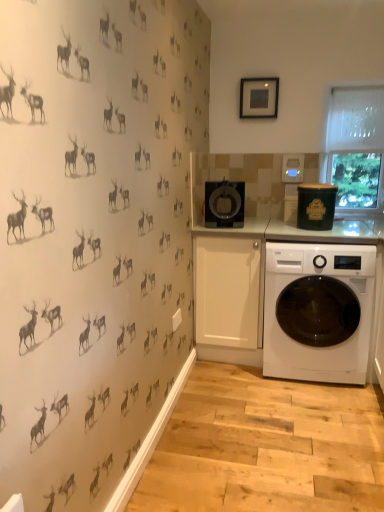
Measure the distance between point (228, 203) and camera.

Point (228, 203) and camera are 8.57 feet apart.

This screenshot has width=384, height=512. Describe the element at coordinates (259, 97) in the screenshot. I see `matte black picture frame at upper center` at that location.

This screenshot has height=512, width=384. What do you see at coordinates (310, 346) in the screenshot? I see `white glossy washing machine at lower right` at bounding box center [310, 346].

Identify the location of black glossy coffee maker at center, which ranks as the 2th appliance in right-to-left order. (224, 204).

Does point (266, 78) lie behind point (363, 259)?

That is True.

Where is `picture frame lying on the left of white glossy washing machine at lower right`? This screenshot has width=384, height=512. picture frame lying on the left of white glossy washing machine at lower right is located at coordinates (259, 97).

Between matte black picture frame at upper center and white glossy washing machine at lower right, which one has smaller width?

With smaller width is matte black picture frame at upper center.

Consider the image. From a real-world perspective, is matte black picture frame at upper center physically located above or below white mesh screen at upper right?

matte black picture frame at upper center is situated higher than white mesh screen at upper right in the real world.

From the picture: What's the angular difference between matte black picture frame at upper center and white mesh screen at upper right's facing directions?

1.02 degrees.

Between matte black picture frame at upper center and white mesh screen at upper right, which one has larger width?

Wider between the two is white mesh screen at upper right.

Is matte black picture frame at upper center facing towards white mesh screen at upper right?

No.

From the image's perspective, is black glossy coffee maker at center, which ranks as the 2th appliance in right-to-left order, located above or below white mesh screen at upper right?

Clearly, from the image's perspective, black glossy coffee maker at center, which ranks as the 2th appliance in right-to-left order, is below white mesh screen at upper right.

Does black glossy coffee maker at center, the 1th appliance positioned from the left, contain white mesh screen at upper right?

No, white mesh screen at upper right is located outside of black glossy coffee maker at center, the 1th appliance positioned from the left.

From a real-world perspective, between black glossy coffee maker at center, which ranks as the 2th appliance in right-to-left order, and white mesh screen at upper right, who is vertically lower?

black glossy coffee maker at center, which ranks as the 2th appliance in right-to-left order, from a real-world perspective.

I want to click on the 1st appliance below the white mesh screen at upper right (from the image's perspective), so click(x=224, y=204).

Find the location of a particular element. window screen that appears on the right of matte black picture frame at upper center is located at coordinates (355, 146).

Which is closer to the camera, (347, 153) or (266, 79)?

Point (347, 153).

Looking at this image, who is smaller, white mesh screen at upper right or matte black picture frame at upper center?

With smaller size is matte black picture frame at upper center.

Considering the relative sizes of white mesh screen at upper right and matte black picture frame at upper center in the image provided, is white mesh screen at upper right shorter than matte black picture frame at upper center?

Incorrect, the height of white mesh screen at upper right does not fall short of that of matte black picture frame at upper center.

Is white glossy washing machine at lower right positioned in front of green matte canister at upper right, which is the second appliance from left to right?

Yes, white glossy washing machine at lower right is in front of green matte canister at upper right, which is the second appliance from left to right.

From a real-world perspective, is white glossy washing machine at lower right physically below green matte canister at upper right, which appears as the first appliance when viewed from the right?

Indeed, from a real-world perspective, white glossy washing machine at lower right is positioned beneath green matte canister at upper right, which appears as the first appliance when viewed from the right.

How much distance is there between white glossy washing machine at lower right and green matte canister at upper right, which is the second appliance from left to right?

white glossy washing machine at lower right and green matte canister at upper right, which is the second appliance from left to right, are 19.29 inches apart from each other.

From a real-world perspective, which appliance is the 1st one above the white glossy washing machine at lower right? Please provide its 2D coordinates.

[(316, 206)]

Could you tell me if white glossy washing machine at lower right is facing white mesh screen at upper right?

No, white glossy washing machine at lower right is not facing towards white mesh screen at upper right.

Considering the relative positions of white glossy washing machine at lower right and white mesh screen at upper right in the image provided, is white glossy washing machine at lower right to the right of white mesh screen at upper right from the viewer's perspective?

No, white glossy washing machine at lower right is not to the right of white mesh screen at upper right.

Is there a large distance between white glossy washing machine at lower right and white mesh screen at upper right?

Absolutely, white glossy washing machine at lower right is distant from white mesh screen at upper right.

Is matte black picture frame at upper center inside green matte canister at upper right, which appears as the first appliance when viewed from the right?

Definitely not — matte black picture frame at upper center is not inside green matte canister at upper right, which appears as the first appliance when viewed from the right.

This screenshot has height=512, width=384. In order to click on the 2nd appliance positioned below the matte black picture frame at upper center (from the image's perspective) in this screenshot , I will do `click(316, 206)`.

Can you tell me how much green matte canister at upper right, which is the second appliance from left to right, and matte black picture frame at upper center differ in facing direction?

They differ by 3.01 degrees in their facing directions.

Measure the distance from green matte canister at upper right, which is the second appliance from left to right, to matte black picture frame at upper center.

green matte canister at upper right, which is the second appliance from left to right, is 27.85 inches away from matte black picture frame at upper center.

The width and height of the screenshot is (384, 512). I want to click on washing machine below the matte black picture frame at upper center (from a real-world perspective), so click(x=310, y=346).

The width and height of the screenshot is (384, 512). I want to click on picture frame on the left of the white mesh screen at upper right, so click(x=259, y=97).

Looking at the image, which one is located further to white glossy washing machine at lower right, white mesh screen at upper right or black glossy coffee maker at center, which ranks as the 2th appliance in right-to-left order?

white mesh screen at upper right lies further to white glossy washing machine at lower right than the other object.

From the image, which object appears to be nearer to black glossy coffee maker at center, which ranks as the 2th appliance in right-to-left order, matte black picture frame at upper center or green matte canister at upper right, which is the second appliance from left to right?

Among the two, green matte canister at upper right, which is the second appliance from left to right, is located nearer to black glossy coffee maker at center, which ranks as the 2th appliance in right-to-left order.

From the image, which object appears to be nearer to black glossy coffee maker at center, which ranks as the 2th appliance in right-to-left order, white mesh screen at upper right or green matte canister at upper right, which appears as the first appliance when viewed from the right?

Based on the image, green matte canister at upper right, which appears as the first appliance when viewed from the right, appears to be nearer to black glossy coffee maker at center, which ranks as the 2th appliance in right-to-left order.

Which object lies nearer to the anchor point matte black picture frame at upper center, white glossy washing machine at lower right or white mesh screen at upper right?

The object closer to matte black picture frame at upper center is white mesh screen at upper right.

Looking at the image, which one is located further to white glossy washing machine at lower right, matte black picture frame at upper center or black glossy coffee maker at center, which ranks as the 2th appliance in right-to-left order?

Among the two, matte black picture frame at upper center is located further to white glossy washing machine at lower right.

Considering their positions, is matte black picture frame at upper center positioned further to white glossy washing machine at lower right than white mesh screen at upper right?

matte black picture frame at upper center is positioned further to the anchor white glossy washing machine at lower right.

Considering their positions, is black glossy coffee maker at center, which ranks as the 2th appliance in right-to-left order, positioned closer to white glossy washing machine at lower right than green matte canister at upper right, which appears as the first appliance when viewed from the right?

green matte canister at upper right, which appears as the first appliance when viewed from the right, is positioned closer to the anchor white glossy washing machine at lower right.

Which object lies further to the anchor point white mesh screen at upper right, matte black picture frame at upper center or black glossy coffee maker at center, which ranks as the 2th appliance in right-to-left order?

Among the two, black glossy coffee maker at center, which ranks as the 2th appliance in right-to-left order, is located further to white mesh screen at upper right.

Locate an element on the screen. appliance between black glossy coffee maker at center, the 1th appliance positioned from the left, and white glossy washing machine at lower right in the up-down direction is located at coordinates (316, 206).

Identify the location of appliance between black glossy coffee maker at center, which ranks as the 2th appliance in right-to-left order, and white mesh screen at upper right, in the horizontal direction. (316, 206).

Locate an element on the screen. appliance between matte black picture frame at upper center and green matte canister at upper right, which is the second appliance from left to right, in the vertical direction is located at coordinates (224, 204).

Identify the location of appliance situated between matte black picture frame at upper center and white mesh screen at upper right from left to right. point(316,206).